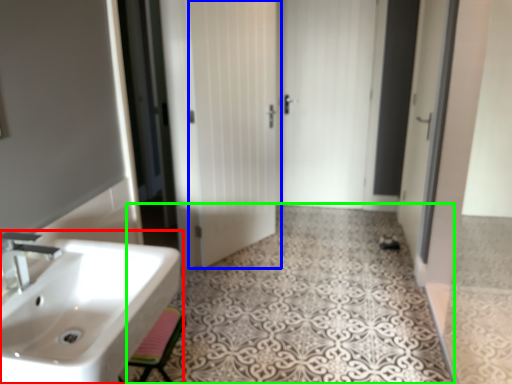
Question: Which object is the closest to the sink (highlighted by a red box)? Choose among these: door (highlighted by a blue box) or pattern (highlighted by a green box).

Choices:
 (A) door
 (B) pattern

Answer: (B)